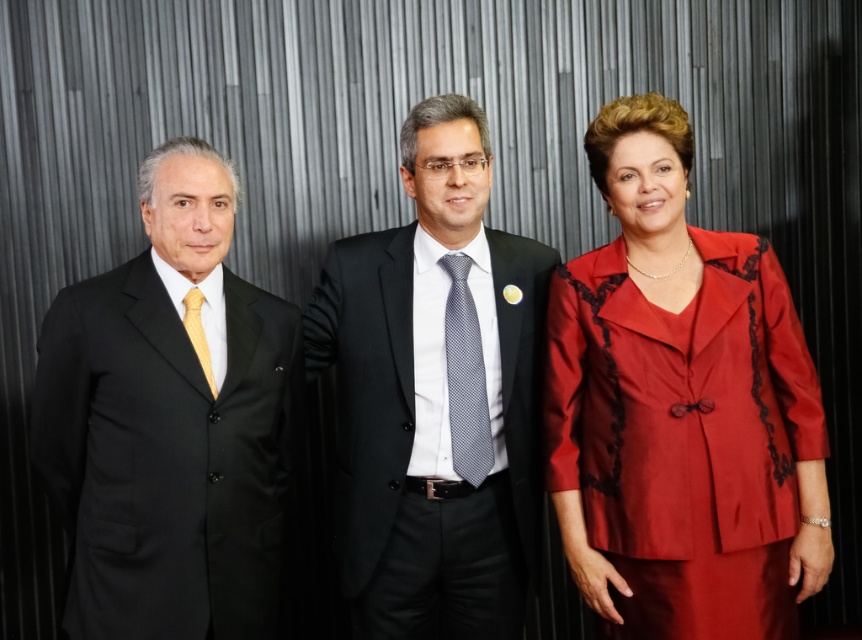
Can you confirm if matte black suit at center is smaller than gray dotted tie at center?

No, matte black suit at center is not smaller than gray dotted tie at center.

Between matte black suit at center and gray dotted tie at center, which one appears on the left side from the viewer's perspective?

matte black suit at center

Is point (508, 284) closer to camera compared to point (464, 456)?

That is False.

You are a GUI agent. You are given a task and a screenshot of the screen. Output one action in this format:
    pyautogui.click(x=<x>, y=<y>)
    Task: Click on the matte black suit at center
    
    Given the screenshot: What is the action you would take?
    pyautogui.click(x=436, y=396)

Who is shorter, satin red dress at right or gray dotted tie at center?

gray dotted tie at center is shorter.

Does satin red dress at right appear over gray dotted tie at center?

Indeed, satin red dress at right is positioned over gray dotted tie at center.

Find the location of a particular element. The height and width of the screenshot is (640, 862). satin red dress at right is located at coordinates (679, 406).

The height and width of the screenshot is (640, 862). I want to click on satin red dress at right, so click(x=679, y=406).

Is satin red dress at right taller than matte black suit at center?

No.

Can you confirm if satin red dress at right is positioned to the right of matte black suit at center?

Correct, you'll find satin red dress at right to the right of matte black suit at center.

Who is more distant from viewer, (819, 420) or (423, 300)?

Point (423, 300)

The width and height of the screenshot is (862, 640). I want to click on satin red dress at right, so pos(679,406).